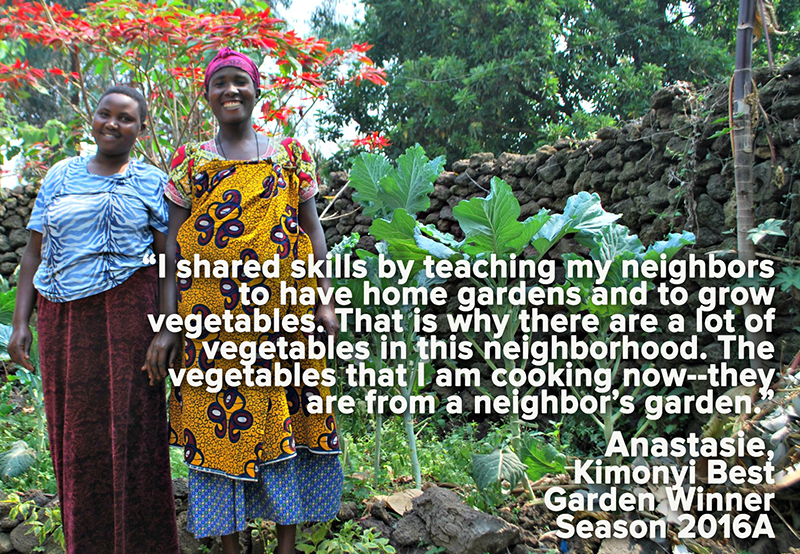
Locate an element on the screen. yellow patterned apron is located at coordinates (257, 223).